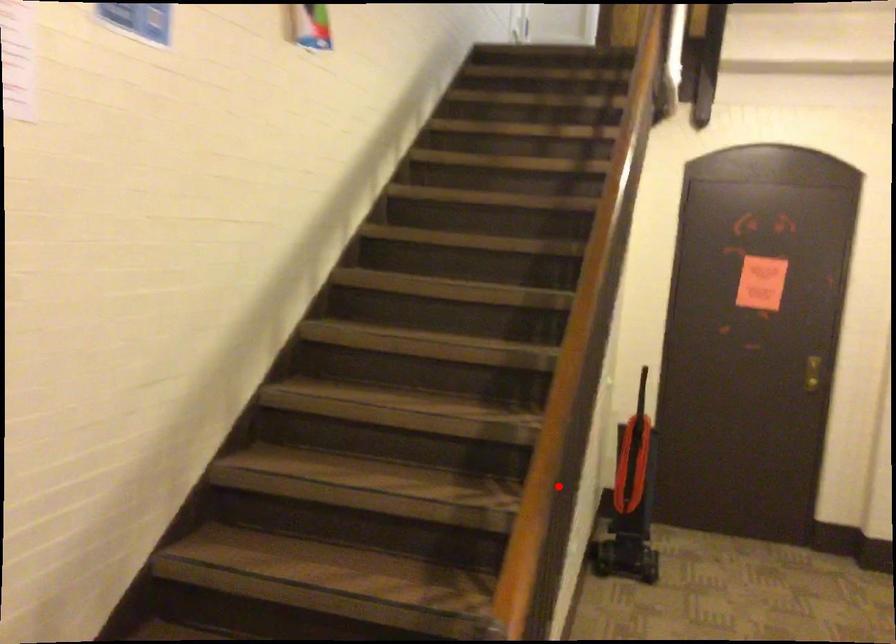
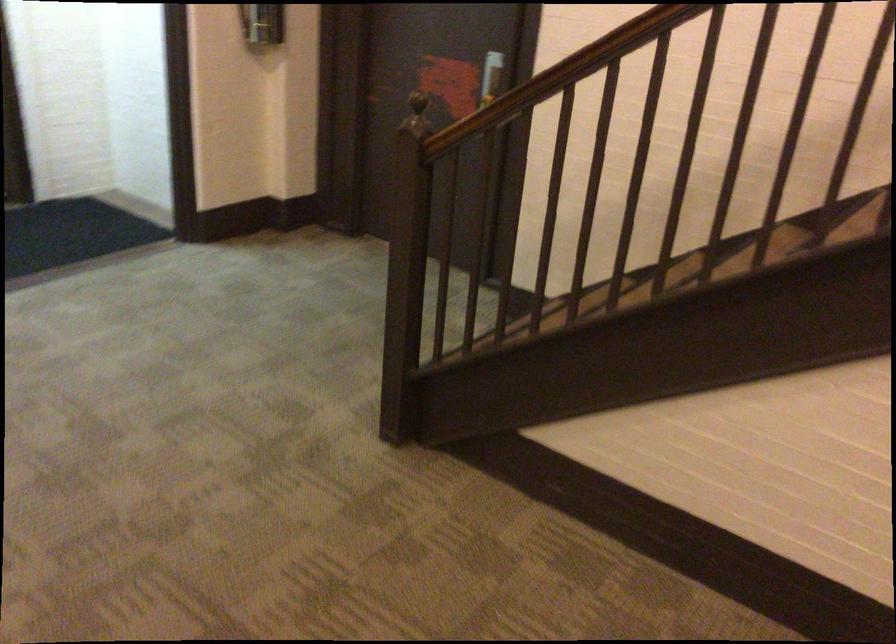
In the second image, find the point that corresponds to the highlighted location in the first image.

(546, 80)